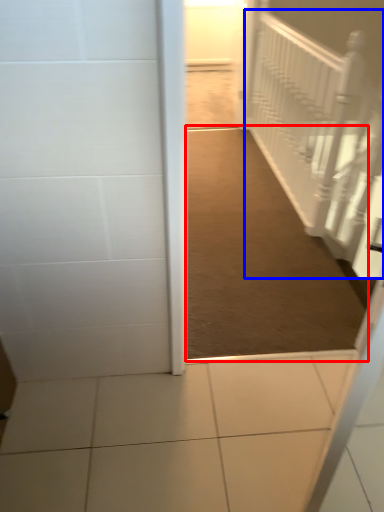
Question: Which object appears farthest to the camera in this image, path (highlighted by a red box) or stairwell (highlighted by a blue box)?

Choices:
 (A) path
 (B) stairwell

Answer: (B)